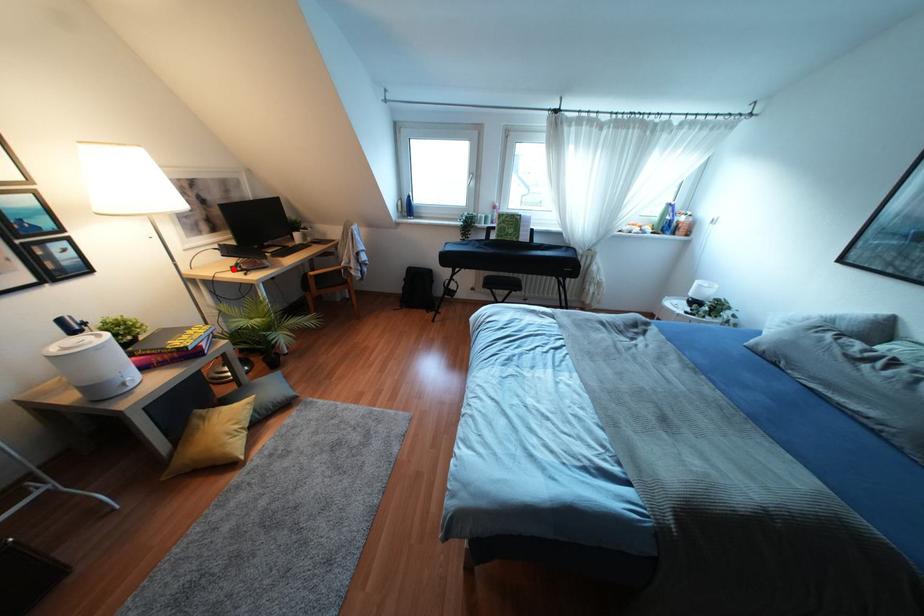
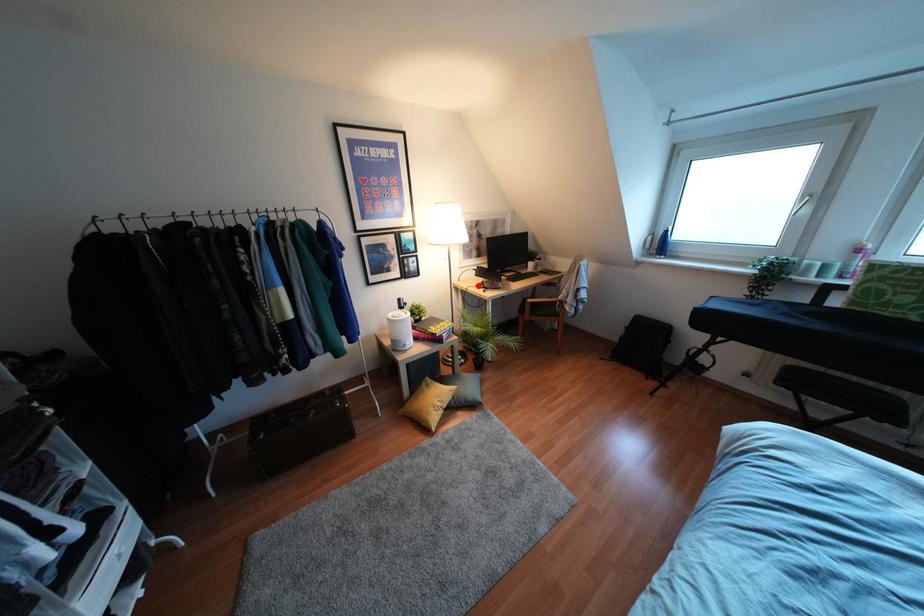
I am providing you with two images of the same scene from different viewpoints. A red point is marked on the first image and another point is marked on the second image. Do the highlighted points in image1 and image2 indicate the same real-world spot?

Yes